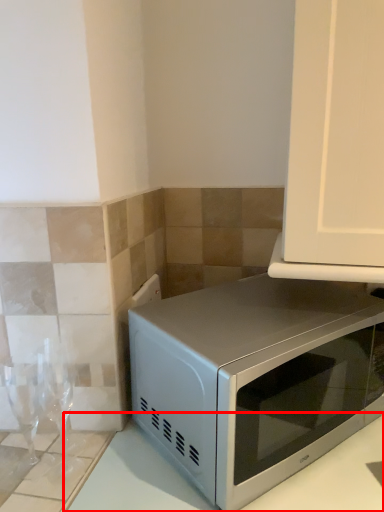
Question: Observing the image, what is the correct spatial positioning of counter top (annotated by the red box) in reference to microwave oven?

Choices:
 (A) right
 (B) left

Answer: (A)